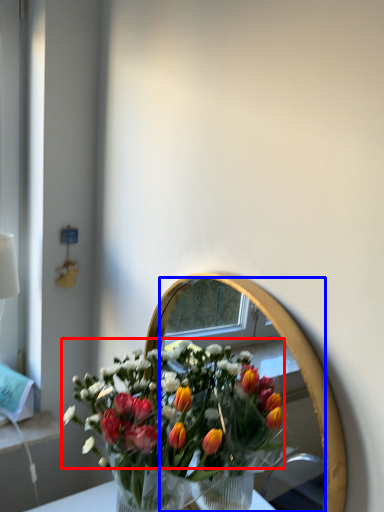
Question: Among these objects, which one is farthest to the camera, flower (highlighted by a red box) or mirror (highlighted by a blue box)?

Choices:
 (A) flower
 (B) mirror

Answer: (A)